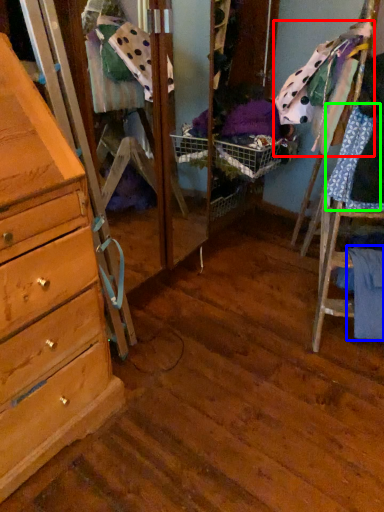
Question: Considering the real-world distances, which object is closest to clothing (highlighted by a red box)? clothing (highlighted by a blue box) or clothing (highlighted by a green box).

Choices:
 (A) clothing
 (B) clothing

Answer: (B)